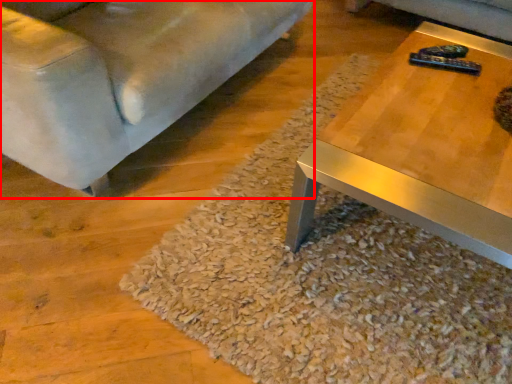
Question: Observing the image, what is the correct spatial positioning of studio couch (annotated by the red box) in reference to gravel?

Choices:
 (A) right
 (B) left

Answer: (B)